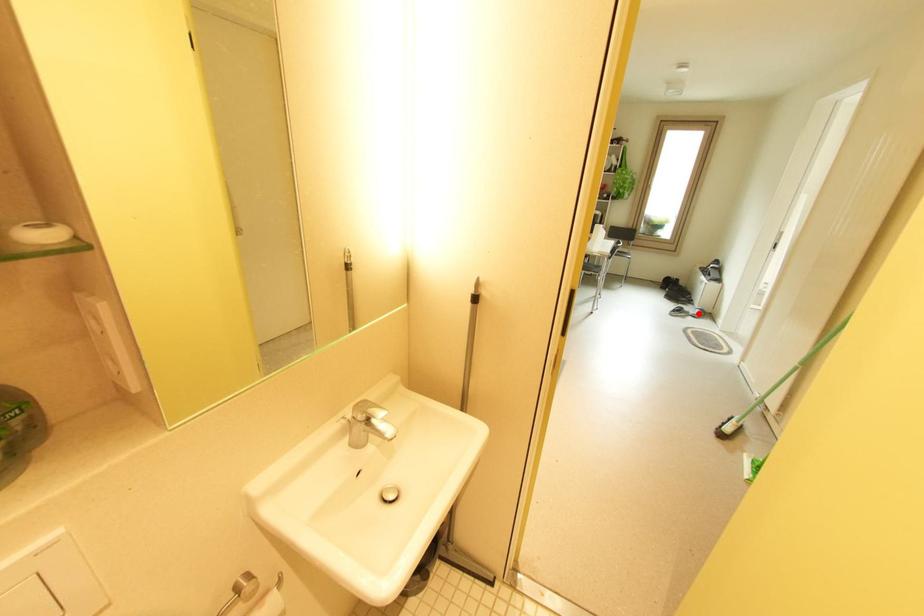
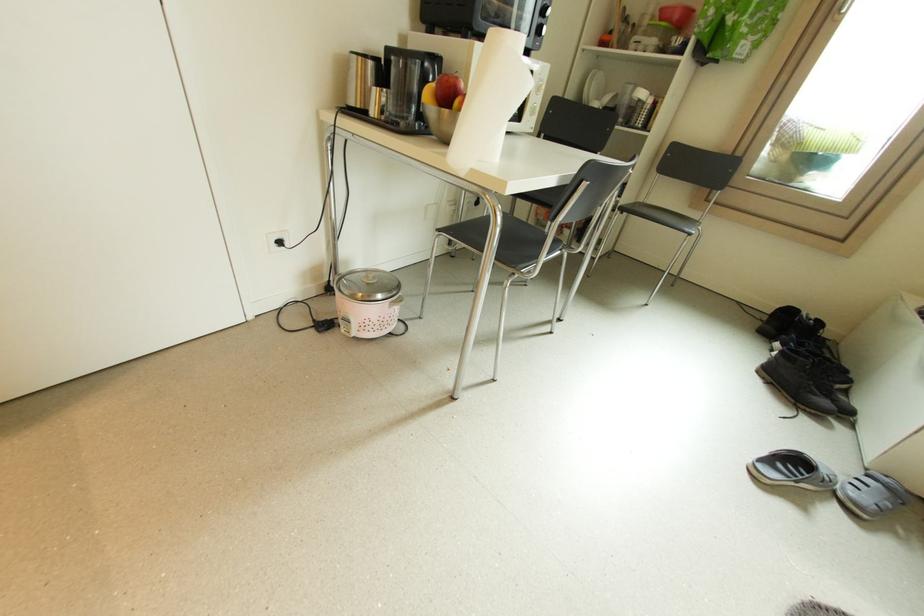
Question: I am providing you with two images of the same scene from different viewpoints. Given a red point in image1, look at the same physical point in image2. Is it:

Choices:
 (A) Closer to the viewpoint
 (B) Farther from the viewpoint

Answer: (B)